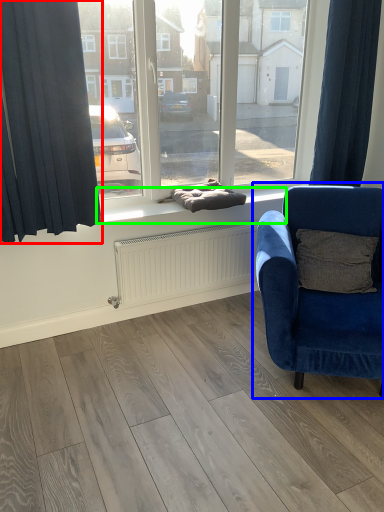
Question: Based on their relative distances, which object is farther from curtain (highlighted by a red box)? Choose from chair (highlighted by a blue box) and window sill (highlighted by a green box).

Choices:
 (A) chair
 (B) window sill

Answer: (A)